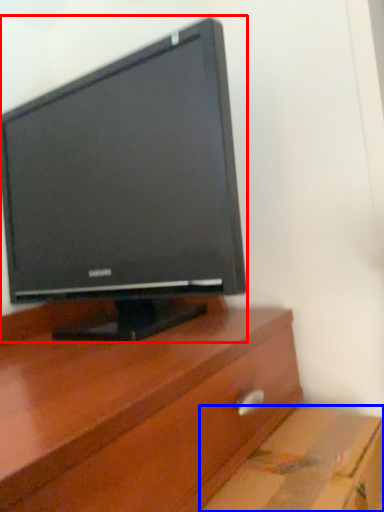
Question: Which object is further to the camera taking this photo, computer monitor (highlighted by a red box) or cardboard box (highlighted by a blue box)?

Choices:
 (A) computer monitor
 (B) cardboard box

Answer: (A)